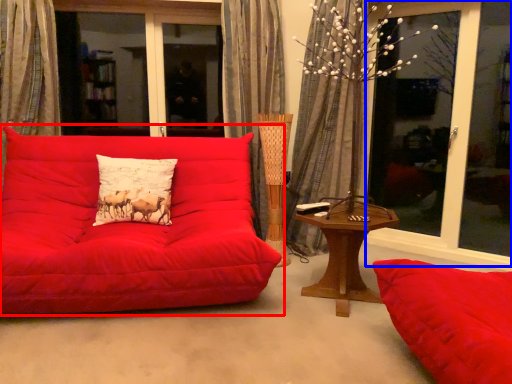
Question: Which object is closer to the camera taking this photo, studio couch (highlighted by a red box) or window screen (highlighted by a blue box)?

Choices:
 (A) studio couch
 (B) window screen

Answer: (A)